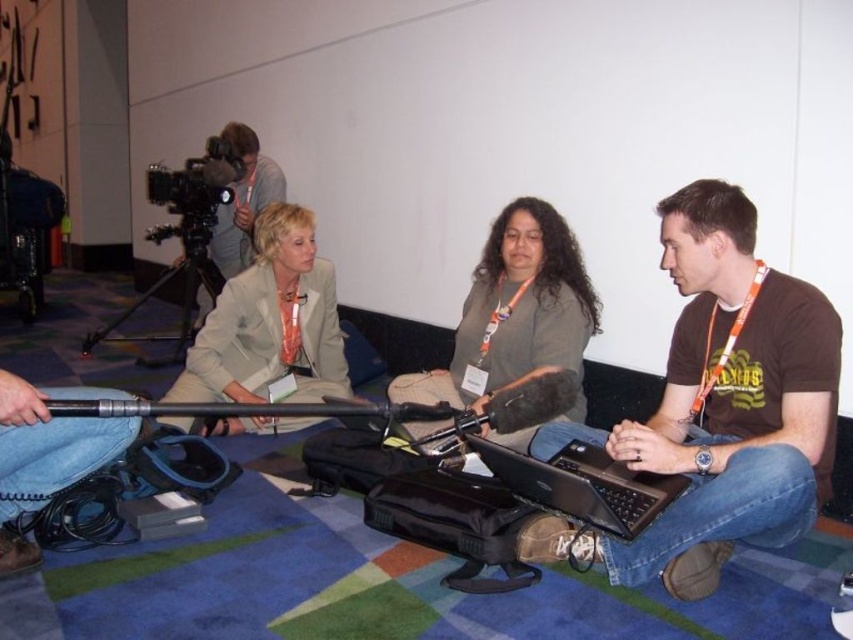
Question: Is brown cotton t-shirt at center right further to camera compared to black metal tripod at lower left?

Choices:
 (A) yes
 (B) no

Answer: (B)

Question: Which of these objects is positioned closest to the black metal tripod at lower left?

Choices:
 (A) black plastic video camera at upper left
 (B) beige fabric jacket at center
 (C) black matte laptop at lower center
 (D) dark green fabric shirt at center

Answer: (A)

Question: Does brown cotton t-shirt at center right appear over black plastic video camera at upper left?

Choices:
 (A) yes
 (B) no

Answer: (B)

Question: Can you confirm if dark green fabric shirt at center is positioned to the left of black matte laptop at lower center?

Choices:
 (A) no
 (B) yes

Answer: (B)

Question: Which object is farther from the camera taking this photo?

Choices:
 (A) black plastic video camera at upper left
 (B) dark green fabric shirt at center

Answer: (A)

Question: Which object is positioned closest to the beige fabric jacket at center?

Choices:
 (A) black plastic video camera at upper left
 (B) dark green fabric shirt at center
 (C) black metal tripod at lower left
 (D) brown cotton t-shirt at center right

Answer: (B)